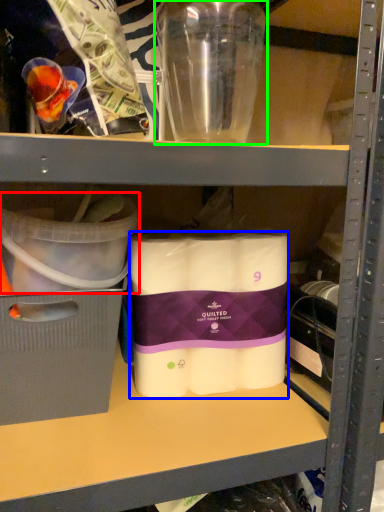
Question: Which object is the closest to the storage box (highlighted by a red box)? Choose among these: toilet paper (highlighted by a blue box) or bottle (highlighted by a green box).

Choices:
 (A) toilet paper
 (B) bottle

Answer: (A)